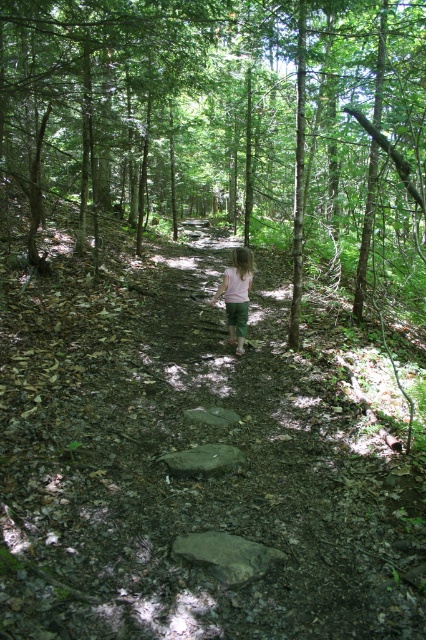
You are a hiker carrying a 28 inch backpack. You see the brown rough rock at center and the gray smooth rock at center. Can you place your backpack between them without it overlapping either rock?

The distance between the brown rough rock at center and the gray smooth rock at center is 30.55 inches. Since your backpack is 28 inches wide, it can fit between them without overlapping either rock.

You are a hiker carrying a backpack that is 2 feet wide. You want to step over the gray rough rock at center and the gray smooth rock at center. Can you fit your backpack between them without touching either rock?

The gray rough rock at center and the gray smooth rock at center are 6.85 feet apart. Since your backpack is only 2 feet wide, there is enough space between the rocks to step over them while keeping the backpack between them without touching either rock.

You are a hiker trying to step on the gray rough rock at center and the gray smooth rock at center. Which one do you think you can step on first if you are walking along the path towards the child?

The gray rough rock at center is larger in size compared to the gray smooth rock at center, so you can step on the gray rough rock at center first.